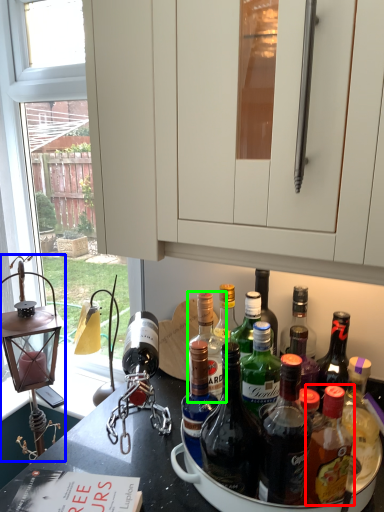
Question: Based on their relative distances, which object is farther from bottle (highlighted by a red box)? Choose from oil lamp (highlighted by a blue box) and bottle (highlighted by a green box).

Choices:
 (A) oil lamp
 (B) bottle

Answer: (A)